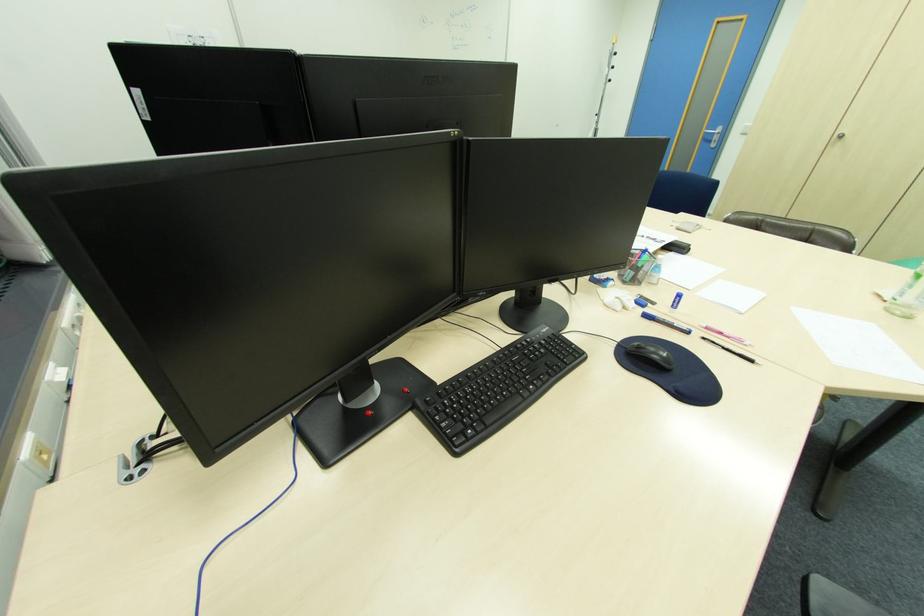
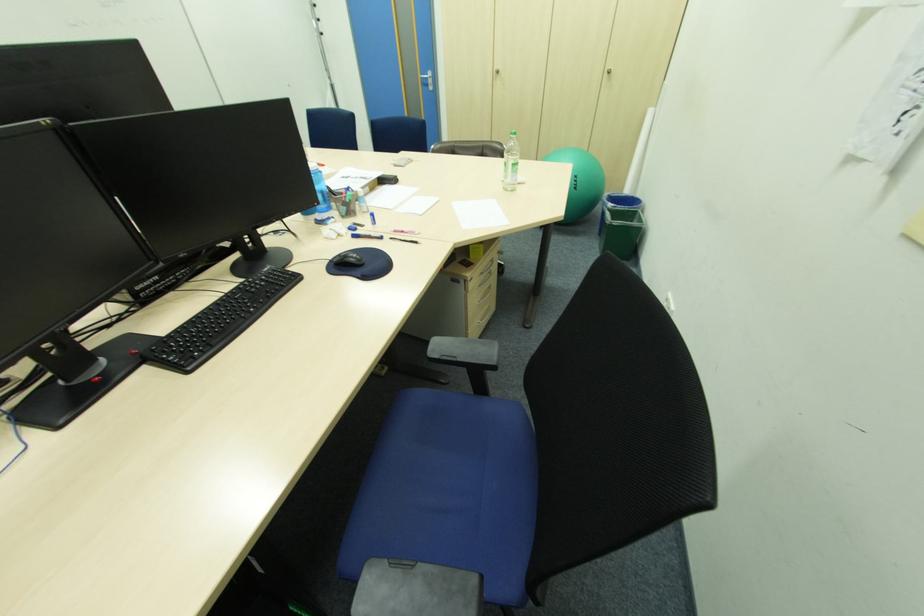
Question: I am providing you with two images of the same scene from different viewpoints. After the viewpoint changes to image2, which objects are now occluded?

Choices:
 (A) black marker
 (B) clear pen holder
 (C) blue water bottle
 (D) none of these

Answer: (D)